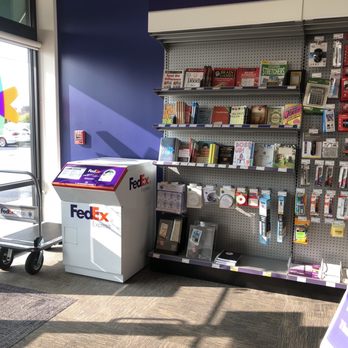
Locate an element on the screen. shadows on the wall is located at coordinates (126, 93), (119, 142).